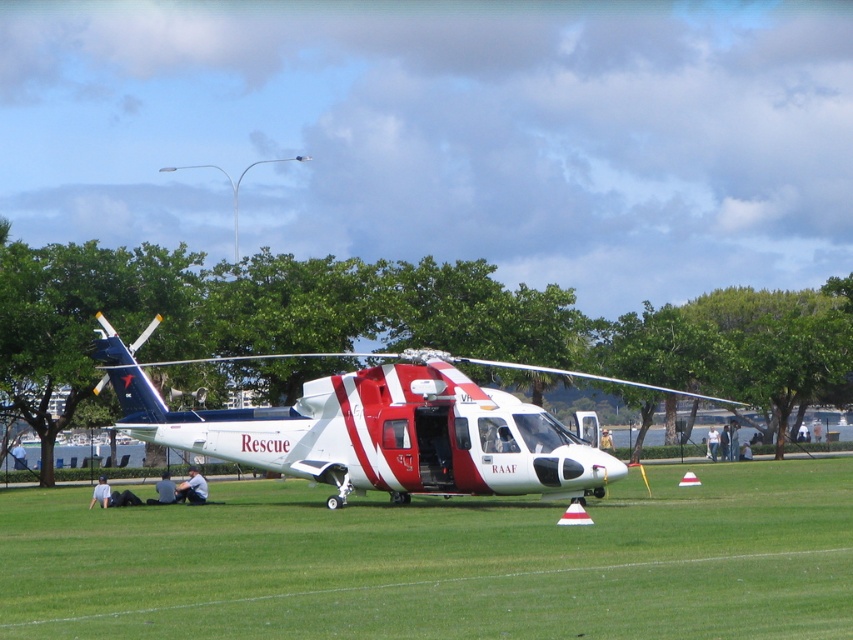
You are standing in front of the rescue helicopter and want to take a photo. There are two points marked in the image at coordinates point (300,497) and point (514,444). Which point should you focus on to ensure the subject is closer to the camera?

Point (300,497) is further to the camera than point (514,444), so you should focus on point (300,497) to ensure the subject is closer to the camera.

You are a photographer trying to capture a wide shot of the red and white rescue helicopter at center. You want to ensure the green grass at center is visible in the frame. Based on their relative sizes, which object will occupy more of the image horizontally?

The green grass at center has a larger width than the red and white rescue helicopter at center, so it will occupy more horizontal space in the image.